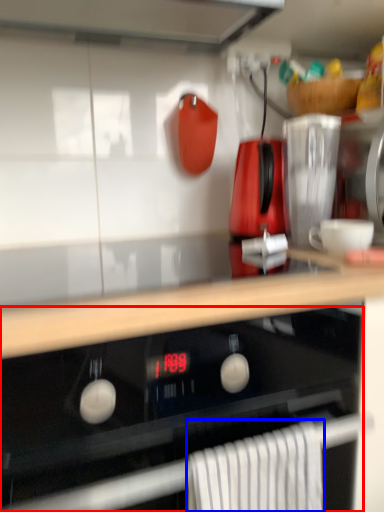
Question: Which point is closer to the camera, oven (highlighted by a red box) or bath towel (highlighted by a blue box)?

Choices:
 (A) oven
 (B) bath towel

Answer: (A)